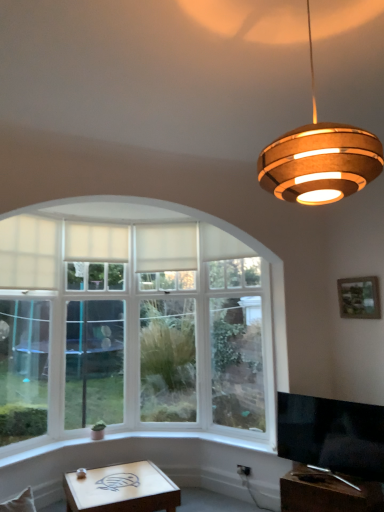
Question: From the image's perspective, is black glossy tv at lower right located beneath wooden picture frame at upper right?

Choices:
 (A) yes
 (B) no

Answer: (A)

Question: Considering the relative sizes of black glossy tv at lower right and wooden picture frame at upper right in the image provided, is black glossy tv at lower right shorter than wooden picture frame at upper right?

Choices:
 (A) yes
 (B) no

Answer: (B)

Question: Is black glossy tv at lower right facing away from wooden picture frame at upper right?

Choices:
 (A) no
 (B) yes

Answer: (A)

Question: Is black glossy tv at lower right located outside wooden picture frame at upper right?

Choices:
 (A) no
 (B) yes

Answer: (B)

Question: Does black glossy tv at lower right have a larger size compared to wooden picture frame at upper right?

Choices:
 (A) no
 (B) yes

Answer: (B)

Question: Considering the positions of wooden pendant light at upper right and wooden at lower right, the first table viewed from the right, in the image, is wooden pendant light at upper right taller or shorter than wooden at lower right, the first table viewed from the right,?

Choices:
 (A) short
 (B) tall

Answer: (B)

Question: Based on their sizes in the image, would you say wooden pendant light at upper right is bigger or smaller than wooden at lower right, which is counted as the 2th table, starting from the left?

Choices:
 (A) big
 (B) small

Answer: (B)

Question: Based on their positions, is wooden pendant light at upper right located to the left or right of wooden at lower right, which is counted as the 2th table, starting from the left?

Choices:
 (A) right
 (B) left

Answer: (B)

Question: Looking at their shapes, would you say wooden pendant light at upper right is wider or thinner than wooden at lower right, the first table viewed from the right?

Choices:
 (A) wide
 (B) thin

Answer: (B)

Question: In terms of width, does matte white wooden table at lower center, positioned as the 1th table in left-to-right order, look wider or thinner when compared to wooden at lower right, which is counted as the 2th table, starting from the left?

Choices:
 (A) wide
 (B) thin

Answer: (A)

Question: Considering the positions of point (180, 501) and point (322, 473), is point (180, 501) closer or farther from the camera than point (322, 473)?

Choices:
 (A) closer
 (B) farther

Answer: (B)

Question: In the image, is matte white wooden table at lower center, positioned as the 1th table in left-to-right order, on the left side or the right side of wooden at lower right, which is counted as the 2th table, starting from the left?

Choices:
 (A) right
 (B) left

Answer: (B)

Question: From their relative heights in the image, would you say matte white wooden table at lower center, positioned as the 1th table in left-to-right order, is taller or shorter than wooden at lower right, which is counted as the 2th table, starting from the left?

Choices:
 (A) short
 (B) tall

Answer: (A)

Question: In terms of width, does matte white wooden table at lower center, the 2th table positioned from the right, look wider or thinner when compared to white fabric curtain at upper left, which appears as the 1th curtain when viewed from the left?

Choices:
 (A) wide
 (B) thin

Answer: (A)

Question: From a real-world perspective, is matte white wooden table at lower center, the 2th table positioned from the right, positioned above or below white fabric curtain at upper left, which appears as the second curtain when viewed from the right?

Choices:
 (A) above
 (B) below

Answer: (B)